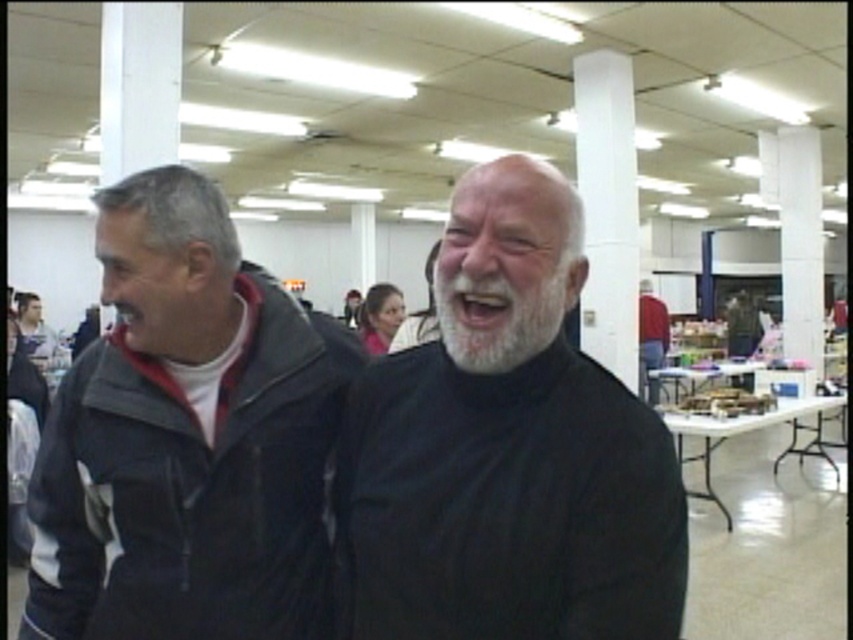
Question: Among these objects, which one is nearest to the camera?

Choices:
 (A) red sweater at center
 (B) dark gray jacket at left
 (C) white matte beard at center
 (D) white smooth pillar at center

Answer: (C)

Question: Does white matte beard at center have a lesser width compared to red sweater at center?

Choices:
 (A) yes
 (B) no

Answer: (A)

Question: Which point is farther to the camera?

Choices:
 (A) dark gray jacket at left
 (B) white fuzzy beard at center
 (C) red sweater at center
 (D) white smooth pillar at center

Answer: (C)

Question: Where is white smooth pillar at center located in relation to red sweater at center in the image?

Choices:
 (A) below
 (B) above

Answer: (B)

Question: Which point appears closest to the camera in this image?

Choices:
 (A) (624, 371)
 (B) (495, 317)
 (C) (650, 392)
 (D) (192, 627)

Answer: (B)

Question: Is white matte beard at center bigger than white fuzzy beard at center?

Choices:
 (A) no
 (B) yes

Answer: (B)